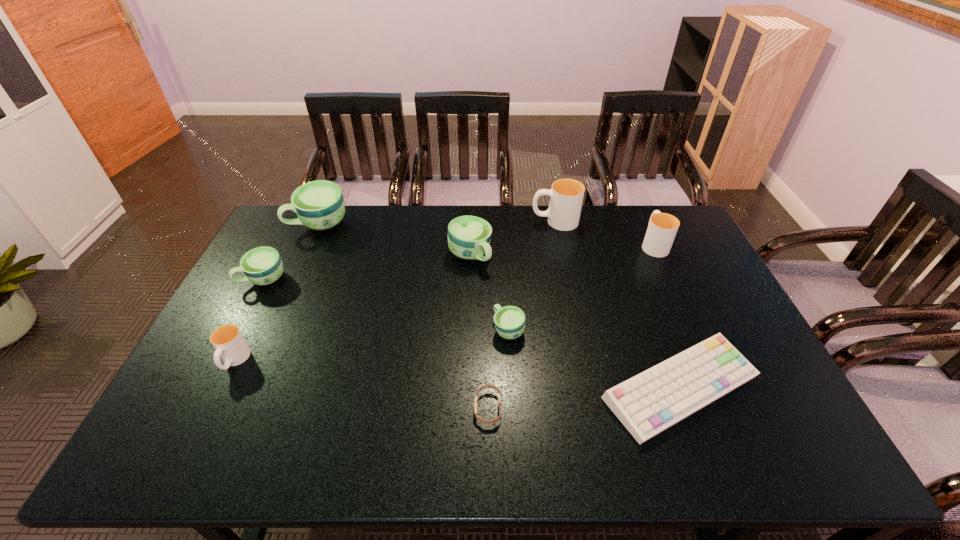
Find the location of a particular element. Image resolution: width=960 pixels, height=540 pixels. free space located 0.160m with the handle on the side of the rightmost cup is located at coordinates (636, 207).

The image size is (960, 540). In order to click on vacant space positioned 0.160m with the handle on the side of the rightmost cup in this screenshot , I will do `click(636, 207)`.

Identify the location of vacant space located 0.400m on the left of the third smallest blue cup. (332, 256).

This screenshot has height=540, width=960. I want to click on free space located 0.310m on the back of the third biggest blue cup, so click(x=299, y=213).

The image size is (960, 540). Identify the location of vacant space located 0.200m with the handle on the side of the leftmost yellow cup. (189, 452).

The image size is (960, 540). Identify the location of vacant region located 0.270m on the front of the sixth farthest cup. pos(516,435).

Where is `vacant area situated on the back of the eighth tallest object`? This screenshot has height=540, width=960. vacant area situated on the back of the eighth tallest object is located at coordinates (650, 310).

This screenshot has width=960, height=540. Find the location of `free space located 0.050m on the face of the shortest object`. free space located 0.050m on the face of the shortest object is located at coordinates (454, 408).

At what (x,y) coordinates should I click in order to perform the action: click on free spot located 0.360m on the face of the shortest object. Please return your answer as a coordinate pair (x, y). Looking at the image, I should click on (329, 408).

Identify the location of vacant area located 0.100m on the face of the shortest object. The image size is (960, 540). (434, 408).